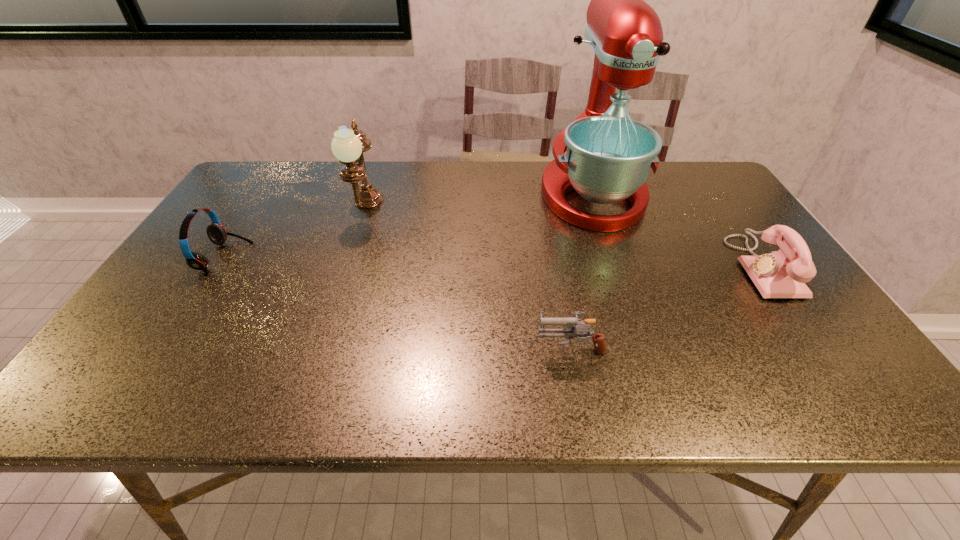
Locate an element on the screen. Image resolution: width=960 pixels, height=540 pixels. vacant space at the far edge is located at coordinates (466, 172).

In the image, there is a desktop. Where is `vacant region at the near edge`? The width and height of the screenshot is (960, 540). vacant region at the near edge is located at coordinates (x=302, y=398).

Locate an element on the screen. vacant space at the left edge of the desktop is located at coordinates (202, 247).

Find the location of a particular element. The image size is (960, 540). vacant area at the right edge of the desktop is located at coordinates (x=697, y=209).

You are a GUI agent. You are given a task and a screenshot of the screen. Output one action in this format:
    pyautogui.click(x=<x>, y=<y>)
    Task: Click on the vacant area at the far left corner
    
    Given the screenshot: What is the action you would take?
    pyautogui.click(x=280, y=188)

In the image, there is a desktop. At what (x,y) coordinates should I click in order to perform the action: click on vacant area at the far right corner. Please return your answer as a coordinate pair (x, y). The width and height of the screenshot is (960, 540). Looking at the image, I should click on (706, 187).

At what (x,y) coordinates should I click in order to perform the action: click on vacant space in between the telephone and the gun. Please return your answer as a coordinate pair (x, y). Looking at the image, I should click on (666, 307).

Find the location of `vacant space that's between the fourth object from right to left and the telephone`. vacant space that's between the fourth object from right to left and the telephone is located at coordinates (564, 238).

Locate an element on the screen. Image resolution: width=960 pixels, height=540 pixels. free space between the fourth object from right to left and the mixer is located at coordinates (479, 201).

Identify the location of vacant region between the mixer and the telephone. (677, 230).